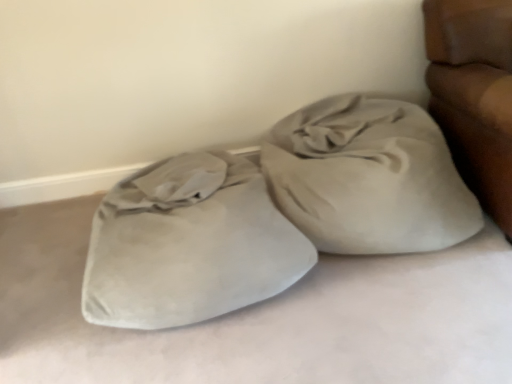
You are a GUI agent. You are given a task and a screenshot of the screen. Output one action in this format:
    pyautogui.click(x=<x>, y=<y>)
    Task: Click on the suede-like beige sleeping bag at lower left
    The image size is (512, 384).
    Given the screenshot: What is the action you would take?
    pyautogui.click(x=189, y=244)

What do you see at coordinates (189, 244) in the screenshot?
I see `suede-like beige sleeping bag at lower left` at bounding box center [189, 244].

At what (x,y) coordinates should I click in order to perform the action: click on suede-like beige sack at center-right. Please return your answer as a coordinate pair (x, y). This screenshot has height=384, width=512. Looking at the image, I should click on (368, 178).

Describe the element at coordinates (368, 178) in the screenshot. Image resolution: width=512 pixels, height=384 pixels. I see `suede-like beige sack at center-right` at that location.

In order to face suede-like beige sack at center-right, should I rotate leftwards or rightwards?

Rotate right and turn 13.514 degrees.

At what (x,y) coordinates should I click in order to perform the action: click on suede-like beige sleeping bag at lower left. Please return your answer as a coordinate pair (x, y). The image size is (512, 384). Looking at the image, I should click on (189, 244).

Considering the positions of objects suede-like beige sack at center-right and suede-like beige sleeping bag at lower left in the image provided, who is more to the right, suede-like beige sack at center-right or suede-like beige sleeping bag at lower left?

Positioned to the right is suede-like beige sack at center-right.

Between suede-like beige sack at center-right and suede-like beige sleeping bag at lower left, which one is positioned in front?

suede-like beige sleeping bag at lower left is more forward.

Is point (357, 218) positioned before point (135, 234)?

No, (357, 218) is further to viewer.

From the image's perspective, which is above, suede-like beige sack at center-right or suede-like beige sleeping bag at lower left?

suede-like beige sack at center-right appears higher in the image.

From a real-world perspective, who is located higher, suede-like beige sack at center-right or suede-like beige sleeping bag at lower left?

suede-like beige sack at center-right.

Considering the sizes of objects suede-like beige sack at center-right and suede-like beige sleeping bag at lower left in the image provided, who is wider, suede-like beige sack at center-right or suede-like beige sleeping bag at lower left?

suede-like beige sleeping bag at lower left is wider.

Looking at this image, between suede-like beige sack at center-right and suede-like beige sleeping bag at lower left, which one has more height?

suede-like beige sack at center-right.

Considering the sizes of objects suede-like beige sack at center-right and suede-like beige sleeping bag at lower left in the image provided, who is bigger, suede-like beige sack at center-right or suede-like beige sleeping bag at lower left?

With larger size is suede-like beige sleeping bag at lower left.

Is suede-like beige sack at center-right spatially inside suede-like beige sleeping bag at lower left, or outside of it?

suede-like beige sack at center-right is located beyond the bounds of suede-like beige sleeping bag at lower left.

Can you see suede-like beige sack at center-right touching suede-like beige sleeping bag at lower left?

No, suede-like beige sack at center-right is not beside suede-like beige sleeping bag at lower left.

Could you tell me if suede-like beige sack at center-right is turned towards suede-like beige sleeping bag at lower left?

No, suede-like beige sack at center-right is not oriented towards suede-like beige sleeping bag at lower left.

How many degrees apart are the facing directions of suede-like beige sack at center-right and suede-like beige sleeping bag at lower left?

There is a 0.000248-degree angle between the facing directions of suede-like beige sack at center-right and suede-like beige sleeping bag at lower left.

At what (x,y) coordinates should I click in order to perform the action: click on sleeping bag located in front of the suede-like beige sack at center-right. Please return your answer as a coordinate pair (x, y). The width and height of the screenshot is (512, 384). Looking at the image, I should click on (189, 244).

Does suede-like beige sleeping bag at lower left appear on the right side of suede-like beige sack at center-right?

No, suede-like beige sleeping bag at lower left is not to the right of suede-like beige sack at center-right.

From the picture: Is suede-like beige sleeping bag at lower left in front of suede-like beige sack at center-right?

That is True.

Is point (269, 199) positioned after point (385, 203)?

Yes, point (269, 199) is behind point (385, 203).

From the image's perspective, is suede-like beige sleeping bag at lower left above suede-like beige sack at center-right?

No, from the image's perspective, suede-like beige sleeping bag at lower left is not on top of suede-like beige sack at center-right.

From a real-world perspective, which object stands above the other?

suede-like beige sack at center-right, from a real-world perspective.

Can you confirm if suede-like beige sleeping bag at lower left is thinner than suede-like beige sack at center-right?

No, suede-like beige sleeping bag at lower left is not thinner than suede-like beige sack at center-right.

Is suede-like beige sleeping bag at lower left taller than suede-like beige sack at center-right?

No.

Can you confirm if suede-like beige sleeping bag at lower left is smaller than suede-like beige sack at center-right?

No, suede-like beige sleeping bag at lower left is not smaller than suede-like beige sack at center-right.

Is suede-like beige sleeping bag at lower left not inside suede-like beige sack at center-right?

Yes, suede-like beige sleeping bag at lower left is not within suede-like beige sack at center-right.

Would you say suede-like beige sleeping bag at lower left is a long distance from suede-like beige sack at center-right?

No, suede-like beige sleeping bag at lower left is not far away from suede-like beige sack at center-right.

In the scene shown: Could you tell me if suede-like beige sleeping bag at lower left is facing suede-like beige sack at center-right?

No, suede-like beige sleeping bag at lower left is not oriented towards suede-like beige sack at center-right.

How far apart are suede-like beige sleeping bag at lower left and suede-like beige sack at center-right?

They are 16.57 inches apart.

This screenshot has height=384, width=512. Find the location of `sack behind the suede-like beige sleeping bag at lower left`. sack behind the suede-like beige sleeping bag at lower left is located at coordinates (368, 178).

I want to click on sleeping bag below the suede-like beige sack at center-right (from a real-world perspective), so click(189, 244).

Where is `sleeping bag located in front of the suede-like beige sack at center-right`? The height and width of the screenshot is (384, 512). sleeping bag located in front of the suede-like beige sack at center-right is located at coordinates (189, 244).